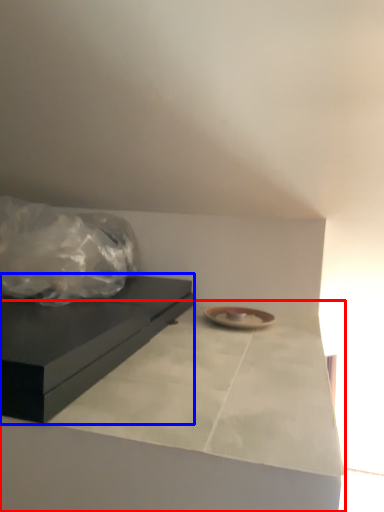
Question: Which object is further to the camera taking this photo, counter top (highlighted by a red box) or table (highlighted by a blue box)?

Choices:
 (A) counter top
 (B) table

Answer: (B)